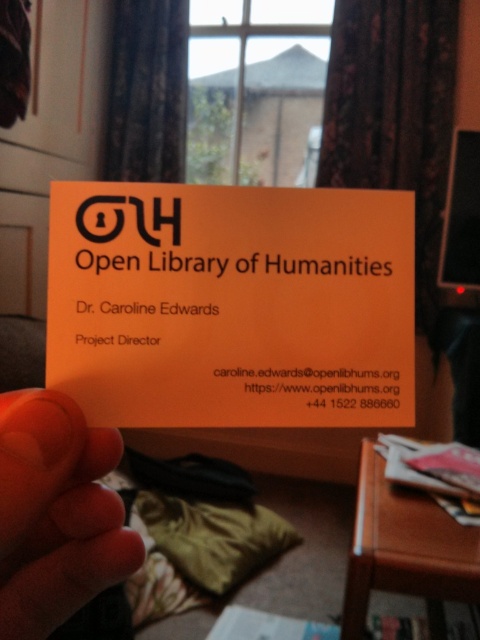
What are the coordinates of the orange matte business card at center?

The orange matte business card at center is located at point (231, 305).